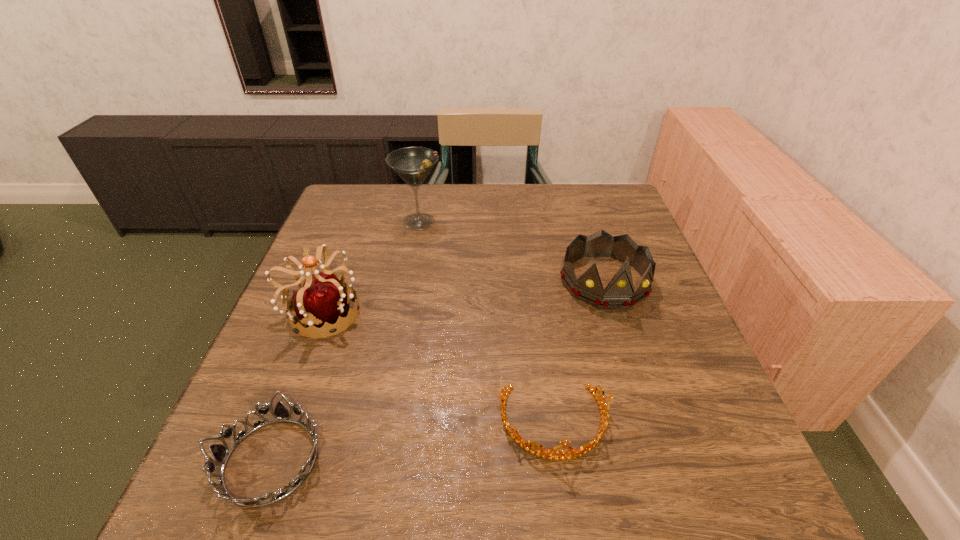
In order to click on vacant area situated 0.300m on the front-facing side of the shortest object in this screenshot , I will do `click(507, 461)`.

Where is `object at the far edge`? The image size is (960, 540). object at the far edge is located at coordinates (413, 164).

At what (x,y) coordinates should I click in order to perform the action: click on object located at the near edge. Please return your answer as a coordinate pair (x, y). This screenshot has width=960, height=540. Looking at the image, I should click on (220, 453).

Image resolution: width=960 pixels, height=540 pixels. Identify the location of object present at the right edge. (619, 293).

Identify the location of object present at the near left corner. Image resolution: width=960 pixels, height=540 pixels. (220, 453).

The height and width of the screenshot is (540, 960). I want to click on vacant space at the far edge of the desktop, so click(x=530, y=213).

At what (x,y) coordinates should I click in order to perform the action: click on vacant space at the right edge of the desktop. Please return your answer as a coordinate pair (x, y). Looking at the image, I should click on (613, 320).

At what (x,y) coordinates should I click in order to perform the action: click on vacant space at the far left corner of the desktop. Please return your answer as a coordinate pair (x, y). Image resolution: width=960 pixels, height=540 pixels. Looking at the image, I should click on (368, 198).

The height and width of the screenshot is (540, 960). What are the coordinates of `vacant space at the far right corner` in the screenshot? It's located at (611, 199).

You are a GUI agent. You are given a task and a screenshot of the screen. Output one action in this format:
    pyautogui.click(x=<x>, y=<y>)
    Task: Click on the free point between the shortest tiara and the third object from left to right
    This screenshot has height=540, width=960.
    Given the screenshot: What is the action you would take?
    pyautogui.click(x=345, y=341)